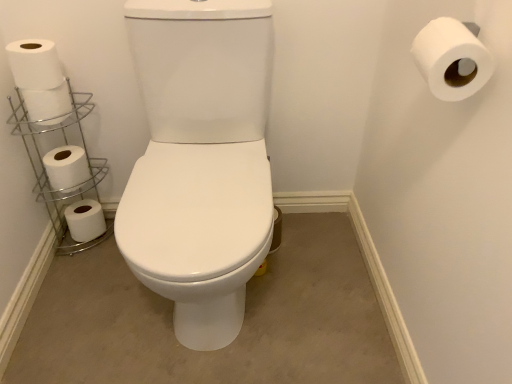
Question: Would you say white matte toilet paper at lower left, the first toilet paper from the left, is to the left or to the right of silver/metallic toilet paper holder at left in the picture?

Choices:
 (A) left
 (B) right

Answer: (A)

Question: Is white matte toilet paper at lower left, the 5th toilet paper when ordered from front to back, bigger or smaller than silver/metallic toilet paper holder at left?

Choices:
 (A) big
 (B) small

Answer: (B)

Question: Estimate the real-world distances between objects in this image. Which object is closer to the white matte toilet paper at lower left, marked as the fifth toilet paper in a right-to-left arrangement?

Choices:
 (A) white matte toilet paper at left, which appears as the 4th toilet paper when viewed from the right
 (B) silver/metallic toilet paper holder at left
 (C) white matte toilet paper at left, which is the second toilet paper from right to left
 (D) white matte toilet paper at left, positioned as the third toilet paper in front-to-back order
 (E) white matte toilet paper at upper right, placed as the 1th toilet paper when sorted from right to left

Answer: (B)

Question: Which is nearer to the white matte toilet paper at left, positioned as the third toilet paper in front-to-back order?

Choices:
 (A) white matte toilet paper at upper right, the first toilet paper viewed from the front
 (B) white matte toilet paper at lower left, the 5th toilet paper when ordered from front to back
 (C) silver/metallic toilet paper holder at left
 (D) white matte toilet paper at left, the 4th toilet paper from the front
 (E) white matte toilet paper at left, which appears as the fourth toilet paper when viewed from the left

Answer: (E)